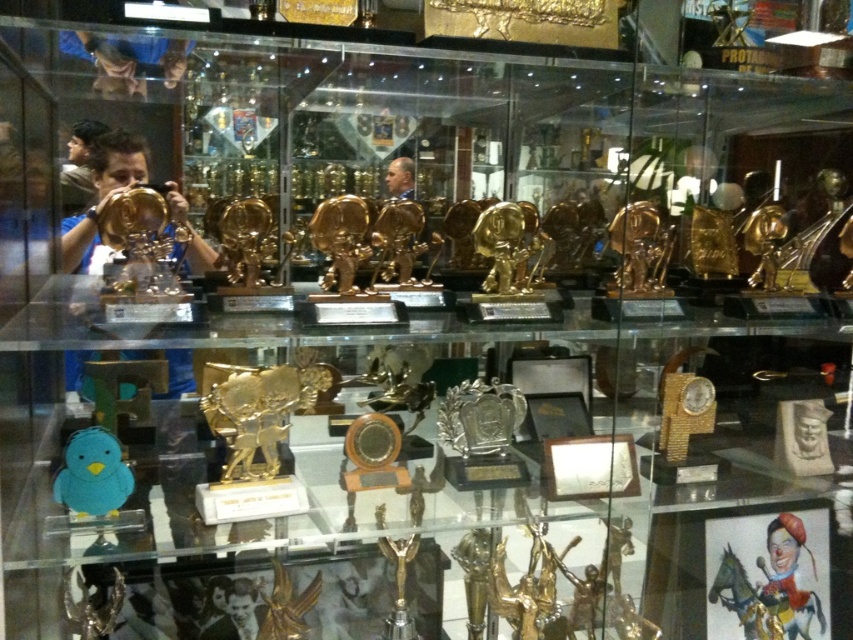
Question: Which point appears farthest from the camera in this image?

Choices:
 (A) (405, 193)
 (B) (196, 269)

Answer: (A)

Question: Can you confirm if matte gold trophy at left is wider than smooth gold statue at center?

Choices:
 (A) no
 (B) yes

Answer: (B)

Question: Does matte gold trophy at left appear on the right side of smooth gold statue at center?

Choices:
 (A) no
 (B) yes

Answer: (A)

Question: Is matte gold trophy at left to the left of smooth gold statue at center from the viewer's perspective?

Choices:
 (A) yes
 (B) no

Answer: (A)

Question: Which object is farther from the camera taking this photo?

Choices:
 (A) smooth gold statue at center
 (B) matte gold trophy at left

Answer: (A)

Question: Among these points, which one is nearest to the camera?

Choices:
 (A) (175, 216)
 (B) (398, 176)

Answer: (A)